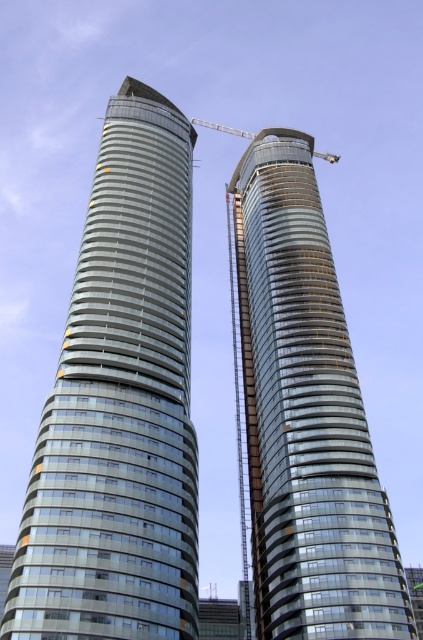
Is glassy metallic skyscraper at left to the right of glassy metallic skyscraper at center from the viewer's perspective?

Incorrect, glassy metallic skyscraper at left is not on the right side of glassy metallic skyscraper at center.

Does glassy metallic skyscraper at left have a greater width compared to glassy metallic skyscraper at center?

No, glassy metallic skyscraper at left is not wider than glassy metallic skyscraper at center.

This screenshot has width=423, height=640. What do you see at coordinates (120, 406) in the screenshot?
I see `glassy metallic skyscraper at left` at bounding box center [120, 406].

I want to click on glassy metallic skyscraper at left, so click(120, 406).

Based on the photo, can you confirm if glassy metallic skyscraper at center is wider than metallic gray crane at upper center?

No, glassy metallic skyscraper at center is not wider than metallic gray crane at upper center.

Which of these two, glassy metallic skyscraper at center or metallic gray crane at upper center, stands taller?

Standing taller between the two is glassy metallic skyscraper at center.

Who is more forward, (272, 509) or (250, 136)?

Point (272, 509) is more forward.

The image size is (423, 640). What are the coordinates of `glassy metallic skyscraper at center` in the screenshot? It's located at (305, 417).

Which is more to the left, glassy metallic skyscraper at left or metallic gray crane at upper center?

glassy metallic skyscraper at left is more to the left.

Can you confirm if glassy metallic skyscraper at left is positioned above metallic gray crane at upper center?

Incorrect, glassy metallic skyscraper at left is not positioned above metallic gray crane at upper center.

Locate an element on the screen. Image resolution: width=423 pixels, height=640 pixels. glassy metallic skyscraper at left is located at coordinates (120, 406).

Image resolution: width=423 pixels, height=640 pixels. I want to click on glassy metallic skyscraper at left, so click(x=120, y=406).